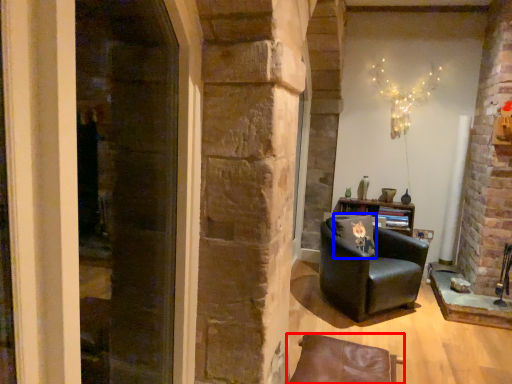
Question: Among these objects, which one is farthest to the camera, chair (highlighted by a red box) or pillow (highlighted by a blue box)?

Choices:
 (A) chair
 (B) pillow

Answer: (B)